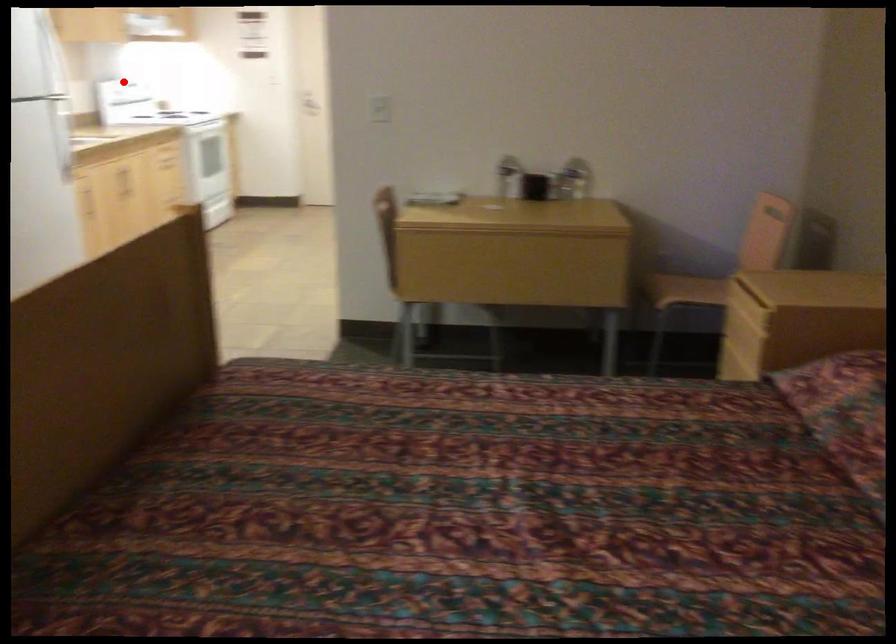
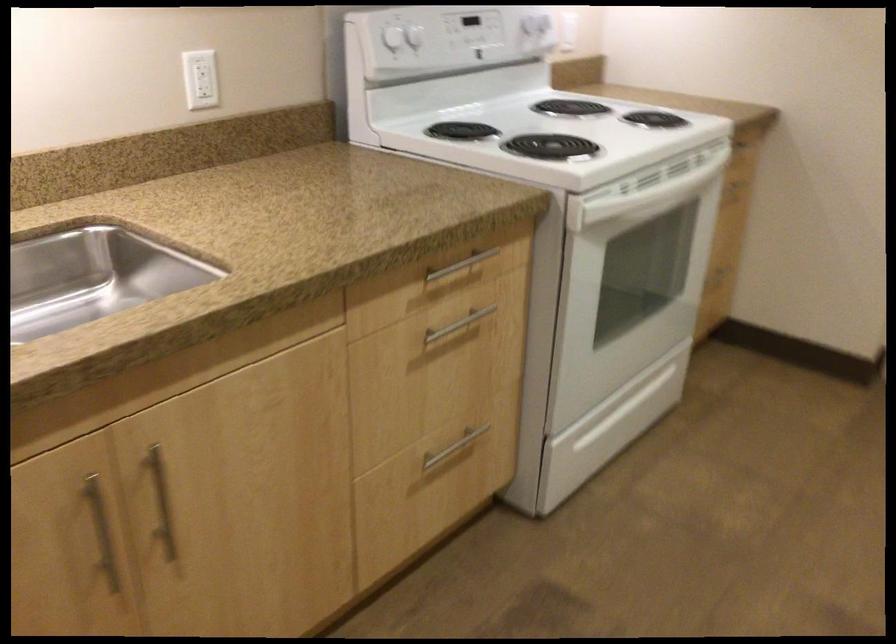
Locate, in the second image, the point that corresponds to the highlighted location in the first image.

(392, 38)